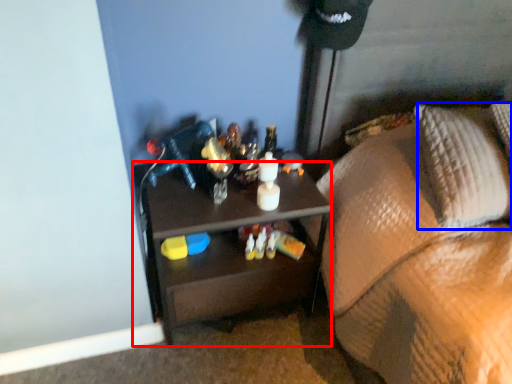
Question: Which of the following is the closest to the observer, desk (highlighted by a red box) or pillow (highlighted by a blue box)?

Choices:
 (A) desk
 (B) pillow

Answer: (B)